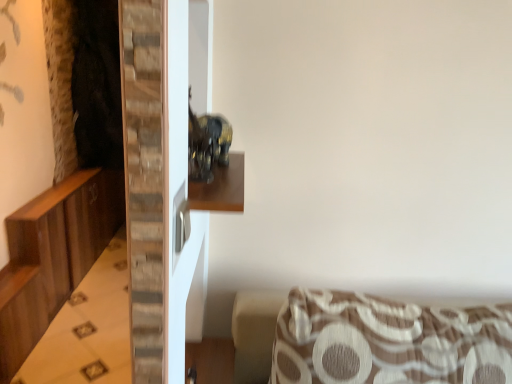
Question: From a real-world perspective, is brown textured cushion at lower right physically located above or below wooden dresser at left?

Choices:
 (A) below
 (B) above

Answer: (B)

Question: Considering the positions of brown textured cushion at lower right and wooden dresser at left in the image, is brown textured cushion at lower right wider or thinner than wooden dresser at left?

Choices:
 (A) wide
 (B) thin

Answer: (B)

Question: Considering the real-world distances, which object is closest to the wooden shelf at center?

Choices:
 (A) wooden dresser at left
 (B) brown textured cushion at lower right

Answer: (B)

Question: Which is farther from the wooden dresser at left?

Choices:
 (A) wooden shelf at center
 (B) brown textured cushion at lower right

Answer: (A)